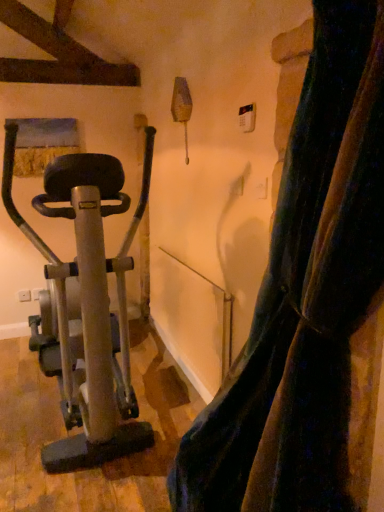
Question: Is silver metallic stationary bicycle at left to the left of velvet dark blue curtain at right from the viewer's perspective?

Choices:
 (A) no
 (B) yes

Answer: (B)

Question: From the image's perspective, is silver metallic stationary bicycle at left beneath velvet dark blue curtain at right?

Choices:
 (A) yes
 (B) no

Answer: (B)

Question: Does silver metallic stationary bicycle at left have a larger size compared to velvet dark blue curtain at right?

Choices:
 (A) yes
 (B) no

Answer: (A)

Question: Is silver metallic stationary bicycle at left behind velvet dark blue curtain at right?

Choices:
 (A) no
 (B) yes

Answer: (B)

Question: Does silver metallic stationary bicycle at left have a lesser width compared to velvet dark blue curtain at right?

Choices:
 (A) yes
 (B) no

Answer: (B)

Question: Does silver metallic stationary bicycle at left turn towards velvet dark blue curtain at right?

Choices:
 (A) yes
 (B) no

Answer: (B)

Question: Can you confirm if velvet dark blue curtain at right is smaller than silver metallic stationary bicycle at left?

Choices:
 (A) no
 (B) yes

Answer: (B)

Question: From a real-world perspective, is velvet dark blue curtain at right on top of silver metallic stationary bicycle at left?

Choices:
 (A) no
 (B) yes

Answer: (B)

Question: From the image's perspective, is velvet dark blue curtain at right over silver metallic stationary bicycle at left?

Choices:
 (A) yes
 (B) no

Answer: (B)

Question: Does velvet dark blue curtain at right have a lesser height compared to silver metallic stationary bicycle at left?

Choices:
 (A) no
 (B) yes

Answer: (A)

Question: Does velvet dark blue curtain at right have a lesser width compared to silver metallic stationary bicycle at left?

Choices:
 (A) yes
 (B) no

Answer: (A)

Question: Can we say velvet dark blue curtain at right lies outside silver metallic stationary bicycle at left?

Choices:
 (A) no
 (B) yes

Answer: (B)

Question: Looking at the image, does silver metallic stationary bicycle at left seem bigger or smaller compared to velvet dark blue curtain at right?

Choices:
 (A) small
 (B) big

Answer: (B)